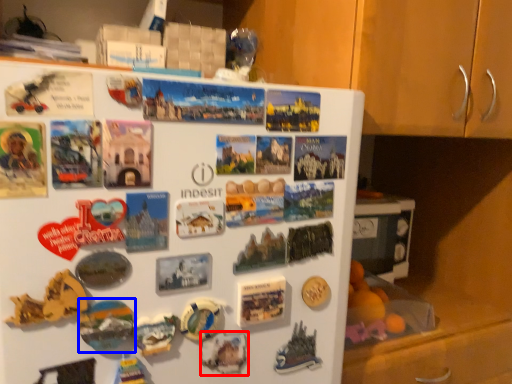
Question: Which of the following is the closest to the observer, art (highlighted by a red box) or art (highlighted by a blue box)?

Choices:
 (A) art
 (B) art

Answer: (B)